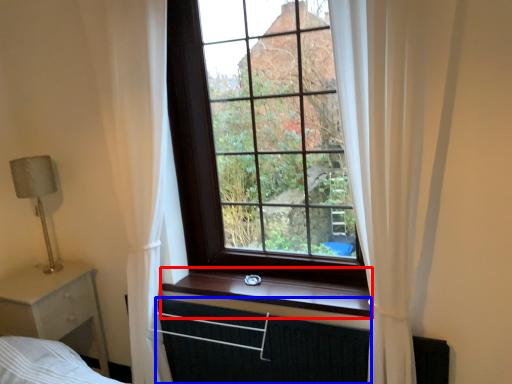
Question: Which point is closer to the camera, window sill (highlighted by a red box) or canopy bed (highlighted by a blue box)?

Choices:
 (A) window sill
 (B) canopy bed

Answer: (B)